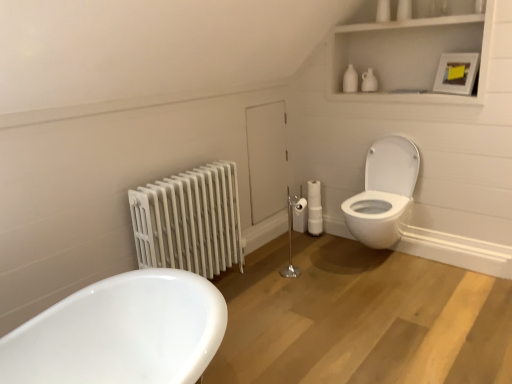
Question: Can you confirm if white glossy toilet at right is wider than white matte cabinet at upper right?

Choices:
 (A) yes
 (B) no

Answer: (A)

Question: From a real-world perspective, is white glossy toilet at right under white matte cabinet at upper right?

Choices:
 (A) yes
 (B) no

Answer: (A)

Question: Does white glossy toilet at right lie in front of white matte cabinet at upper right?

Choices:
 (A) no
 (B) yes

Answer: (A)

Question: Does white glossy toilet at right appear on the left side of white matte cabinet at upper right?

Choices:
 (A) yes
 (B) no

Answer: (A)

Question: From the image's perspective, is white glossy toilet at right above white matte cabinet at upper right?

Choices:
 (A) yes
 (B) no

Answer: (B)

Question: Would you say white glossy toilet at right is a long distance from white matte cabinet at upper right?

Choices:
 (A) yes
 (B) no

Answer: (B)

Question: Can you confirm if white matte cabinet at upper right is bigger than white painted metal radiator at left?

Choices:
 (A) no
 (B) yes

Answer: (B)

Question: Is white matte cabinet at upper right oriented away from white painted metal radiator at left?

Choices:
 (A) yes
 (B) no

Answer: (B)

Question: Would you say white matte cabinet at upper right contains white painted metal radiator at left?

Choices:
 (A) yes
 (B) no

Answer: (B)

Question: Is white matte cabinet at upper right placed right next to white painted metal radiator at left?

Choices:
 (A) yes
 (B) no

Answer: (B)

Question: Is white matte cabinet at upper right smaller than white painted metal radiator at left?

Choices:
 (A) no
 (B) yes

Answer: (A)

Question: Would you say white matte cabinet at upper right is outside white painted metal radiator at left?

Choices:
 (A) yes
 (B) no

Answer: (A)

Question: Does white glossy toilet at right have a lesser width compared to silver metallic toilet paper holder at center?

Choices:
 (A) no
 (B) yes

Answer: (A)